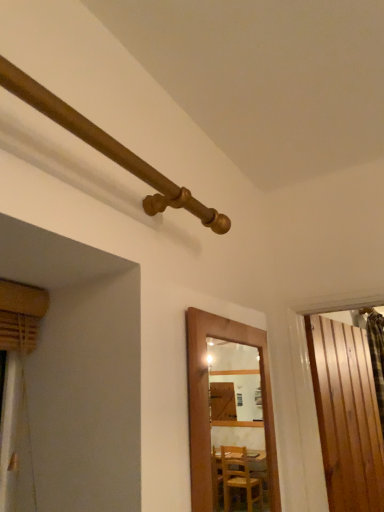
In order to face wooden door at center, which appears as the 2th door when viewed from the back, should I rotate leftwards or rightwards?

Rotate right and turn 6.901 degrees.

What is the approximate width of wooden slats at right, positioned as the first door in right-to-left order?

It is 1.94 inches.

What do you see at coordinates (109, 148) in the screenshot? The width and height of the screenshot is (384, 512). I see `wooden pipe at upper left` at bounding box center [109, 148].

Identify the location of wooden door at center, which appears as the 2th door when viewed from the back. The image size is (384, 512). (207, 401).

In terms of width, does wooden slats at right, positioned as the first door in right-to-left order, look wider or thinner when compared to wooden pipe at upper left?

In the image, wooden slats at right, positioned as the first door in right-to-left order, appears to be more narrow than wooden pipe at upper left.

Is wooden slats at right, positioned as the first door in right-to-left order, further to camera compared to wooden pipe at upper left?

Yes, wooden slats at right, positioned as the first door in right-to-left order, is further from the camera.

Is wooden slats at right, the 2th door when ordered from left to right, looking in the opposite direction of wooden pipe at upper left?

That's not correct — wooden slats at right, the 2th door when ordered from left to right, is not looking away from wooden pipe at upper left.

Which is farther from the camera, [354,360] or [45,101]?

The point [354,360] is farther.

Can you confirm if wooden pipe at upper left is shorter than wooden door at center, positioned as the second door in right-to-left order?

Yes, wooden pipe at upper left is shorter than wooden door at center, positioned as the second door in right-to-left order.

Does wooden pipe at upper left have a smaller size compared to wooden door at center, which appears as the 2th door when viewed from the back?

Yes, wooden pipe at upper left is smaller than wooden door at center, which appears as the 2th door when viewed from the back.

Is wooden pipe at upper left facing towards wooden door at center, marked as the first door in a front-to-back arrangement?

No, wooden pipe at upper left does not turn towards wooden door at center, marked as the first door in a front-to-back arrangement.

Which is correct: wooden pipe at upper left is inside wooden door at center, marked as the first door in a front-to-back arrangement, or outside of it?

wooden pipe at upper left lies outside wooden door at center, marked as the first door in a front-to-back arrangement.

Which is behind, point (230, 332) or point (33, 80)?

The point (230, 332) is farther.

Considering the sizes of objects wooden door at center, marked as the first door in a front-to-back arrangement, and wooden pipe at upper left in the image provided, who is shorter, wooden door at center, marked as the first door in a front-to-back arrangement, or wooden pipe at upper left?

wooden pipe at upper left is shorter.

Find the location of `the 1st door behind the wooden pipe at upper left, starting your count from the anchor`. the 1st door behind the wooden pipe at upper left, starting your count from the anchor is located at coordinates (207, 401).

Considering the relative positions of wooden door at center, which appears as the 2th door when viewed from the back, and wooden pipe at upper left in the image provided, is wooden door at center, which appears as the 2th door when viewed from the back, to the left or to the right of wooden pipe at upper left?

In the image, wooden door at center, which appears as the 2th door when viewed from the back, appears on the right side of wooden pipe at upper left.

Is wooden pipe at upper left with wooden slats at right, the 2th door when ordered from left to right?

No, wooden pipe at upper left is not with wooden slats at right, the 2th door when ordered from left to right.

Does point (1, 71) appear closer or farther from the camera than point (368, 367)?

Point (1, 71) is closer to the camera than point (368, 367).

Based on the photo, is wooden pipe at upper left facing towards wooden slats at right, placed as the 1th door when sorted from back to front?

No, wooden pipe at upper left is not aimed at wooden slats at right, placed as the 1th door when sorted from back to front.

From a real-world perspective, is wooden door at center, marked as the first door in a front-to-back arrangement, positioned over wooden slats at right, the second door viewed from the front, based on gravity?

Yes, from a real-world perspective, wooden door at center, marked as the first door in a front-to-back arrangement, is on top of wooden slats at right, the second door viewed from the front.

In the image, is wooden door at center, positioned as the second door in right-to-left order, positioned in front of or behind wooden slats at right, the second door viewed from the front?

In the image, wooden door at center, positioned as the second door in right-to-left order, appears in front of wooden slats at right, the second door viewed from the front.

Considering the relative positions of wooden door at center, positioned as the second door in right-to-left order, and wooden slats at right, the second door viewed from the front, in the image provided, is wooden door at center, positioned as the second door in right-to-left order, to the left of wooden slats at right, the second door viewed from the front, from the viewer's perspective?

Yes.

Is wooden door at center, positioned as the second door in right-to-left order, positioned far away from wooden slats at right, positioned as the first door in right-to-left order?

No, wooden door at center, positioned as the second door in right-to-left order, is not far from wooden slats at right, positioned as the first door in right-to-left order.

Which object is more forward, wooden slats at right, the second door viewed from the front, or wooden door at center, which is counted as the first door, starting from the left?

wooden door at center, which is counted as the first door, starting from the left, is in front.

In the scene shown: Is wooden slats at right, placed as the 1th door when sorted from back to front, facing away from wooden door at center, which is counted as the first door, starting from the left?

No, wooden slats at right, placed as the 1th door when sorted from back to front, is not facing the opposite direction of wooden door at center, which is counted as the first door, starting from the left.

Can we say wooden slats at right, placed as the 1th door when sorted from back to front, lies outside wooden door at center, which appears as the 2th door when viewed from the back?

Yes, wooden slats at right, placed as the 1th door when sorted from back to front, is outside of wooden door at center, which appears as the 2th door when viewed from the back.

Does wooden slats at right, the second door viewed from the front, appear on the right side of wooden door at center, which appears as the 2th door when viewed from the back?

Correct, you'll find wooden slats at right, the second door viewed from the front, to the right of wooden door at center, which appears as the 2th door when viewed from the back.

From the wooden pipe at upper left, count 2nd door to the right and point to it. Please provide its 2D coordinates.

[(346, 415)]

Locate an element on the screen. pipe in front of the wooden door at center, marked as the first door in a front-to-back arrangement is located at coordinates (109, 148).

Estimate the real-world distances between objects in this image. Which object is further from wooden slats at right, the 2th door when ordered from left to right, wooden pipe at upper left or wooden door at center, positioned as the second door in right-to-left order?

wooden pipe at upper left is further to wooden slats at right, the 2th door when ordered from left to right.

Based on their spatial positions, is wooden door at center, positioned as the second door in right-to-left order, or wooden pipe at upper left further from wooden slats at right, the second door viewed from the front?

wooden pipe at upper left lies further to wooden slats at right, the second door viewed from the front, than the other object.

Which object lies nearer to the anchor point wooden door at center, which appears as the 2th door when viewed from the back, wooden pipe at upper left or wooden slats at right, the 2th door when ordered from left to right?

Based on the image, wooden pipe at upper left appears to be nearer to wooden door at center, which appears as the 2th door when viewed from the back.

In the scene shown: Which object lies further to the anchor point wooden pipe at upper left, wooden door at center, which appears as the 2th door when viewed from the back, or wooden slats at right, the 2th door when ordered from left to right?

wooden slats at right, the 2th door when ordered from left to right, is positioned further to the anchor wooden pipe at upper left.

Considering their positions, is wooden slats at right, the second door viewed from the front, positioned further to wooden door at center, which is counted as the first door, starting from the left, than wooden pipe at upper left?

wooden slats at right, the second door viewed from the front, is further to wooden door at center, which is counted as the first door, starting from the left.

Estimate the real-world distances between objects in this image. Which object is further from wooden pipe at upper left, wooden slats at right, placed as the 1th door when sorted from back to front, or wooden door at center, marked as the first door in a front-to-back arrangement?

wooden slats at right, placed as the 1th door when sorted from back to front, is further to wooden pipe at upper left.

Identify the location of door between wooden pipe at upper left and wooden slats at right, positioned as the first door in right-to-left order, from front to back. The width and height of the screenshot is (384, 512). (207, 401).